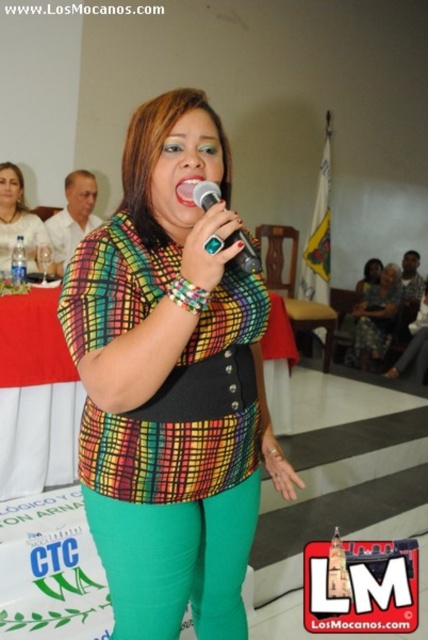
Is matte black microphone at upper center below teal plastic microphone at center?

No.

From the picture: Between matte black microphone at upper center and teal plastic microphone at center, which one has more height?

Standing taller between the two is matte black microphone at upper center.

Describe the element at coordinates (17, 220) in the screenshot. Image resolution: width=428 pixels, height=640 pixels. I see `matte black microphone at upper center` at that location.

Find the location of a particular element. matte black microphone at upper center is located at coordinates (17, 220).

Is matte black microphone at upper center above pink glossy lips at center?

Correct, matte black microphone at upper center is located above pink glossy lips at center.

Is point (36, 248) less distant than point (192, 205)?

No, (36, 248) is behind (192, 205).

The image size is (428, 640). In order to click on matte black microphone at upper center in this screenshot , I will do `click(17, 220)`.

Who is more distant from viewer, (400, 291) or (193, 184)?

Point (400, 291)

Consider the image. Between printed fabric dress at center and pink glossy lips at center, which one is positioned lower?

Positioned lower is printed fabric dress at center.

Where is `printed fabric dress at center`? printed fabric dress at center is located at coordinates (376, 320).